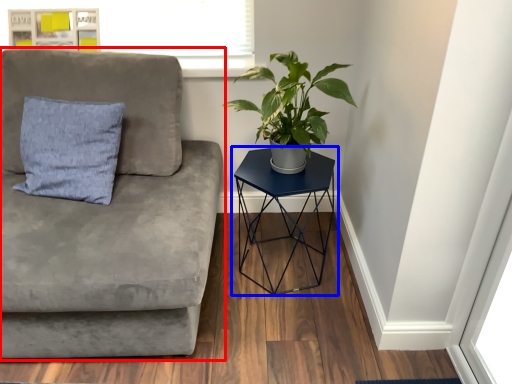
Question: Which of the following is the farthest to the observer, studio couch (highlighted by a red box) or table (highlighted by a blue box)?

Choices:
 (A) studio couch
 (B) table

Answer: (B)